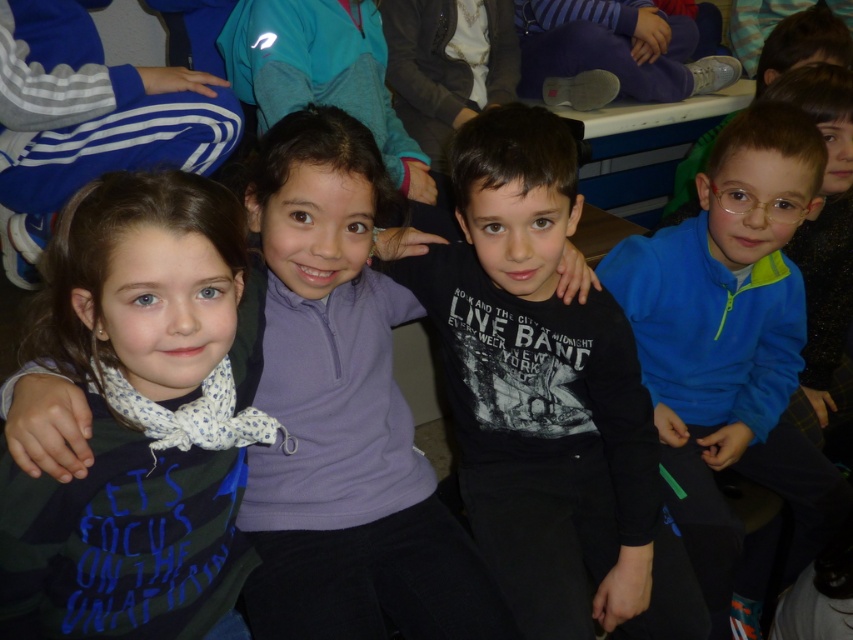
Between black matte shirt at center and blue fleece jacket at right, which one appears on the left side from the viewer's perspective?

black matte shirt at center is more to the left.

Who is positioned more to the right, black matte shirt at center or blue fleece jacket at right?

From the viewer's perspective, blue fleece jacket at right appears more on the right side.

The width and height of the screenshot is (853, 640). What are the coordinates of `black matte shirt at center` in the screenshot? It's located at (538, 384).

Who is taller, black matte shirt at center or camouflage fabric shirt at left?

black matte shirt at center is taller.

Between point (618, 499) and point (91, 307), which one is positioned behind?

Point (618, 499)

Is point (479, 296) closer to viewer compared to point (78, 218)?

No.

Find the location of a particular element. black matte shirt at center is located at coordinates (538, 384).

Between camouflage fabric shirt at left and blue fleece jacket at right, which one is positioned lower?

blue fleece jacket at right is below.

The height and width of the screenshot is (640, 853). What do you see at coordinates (122, 540) in the screenshot?
I see `camouflage fabric shirt at left` at bounding box center [122, 540].

I want to click on camouflage fabric shirt at left, so click(122, 540).